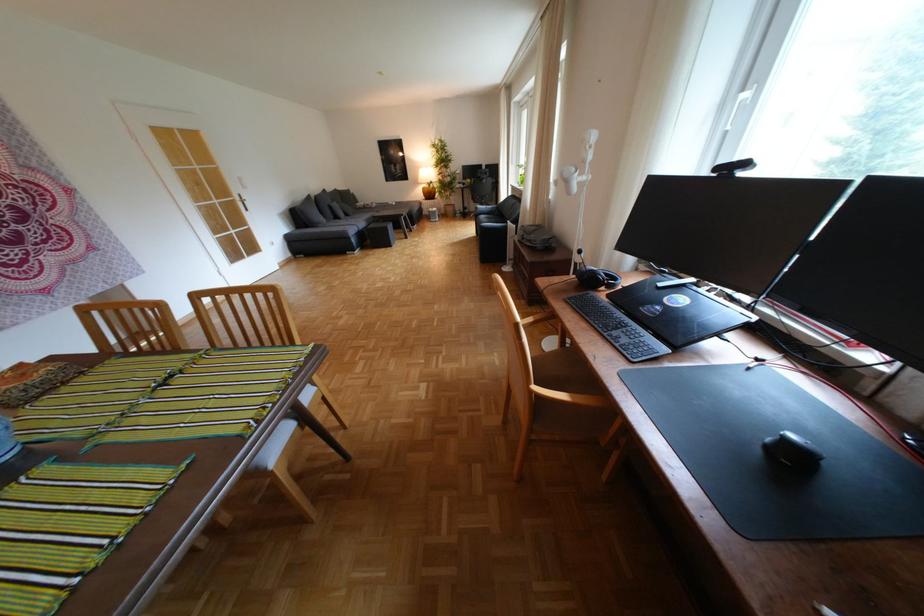
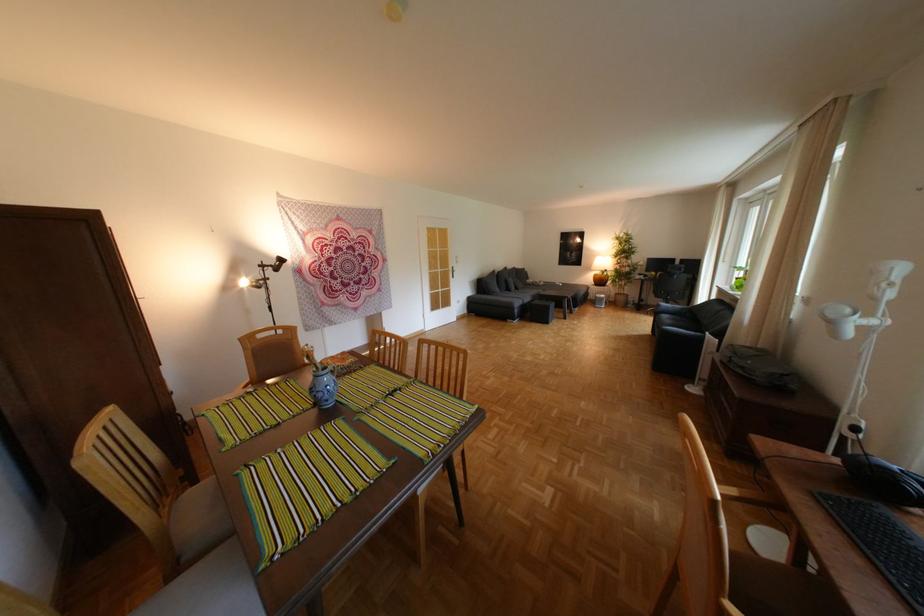
Find the pixel in the second image that matches [518,227] in the first image.

(715, 338)